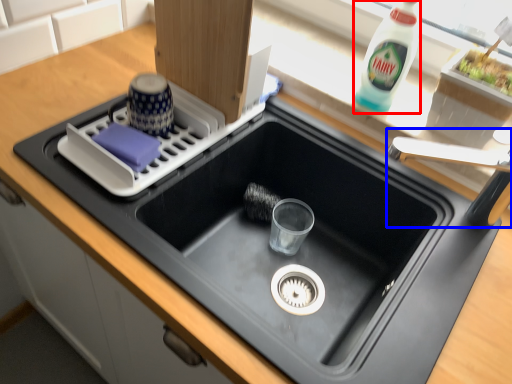
Question: Which of the following is the farthest to the observer, bottle (highlighted by a red box) or faucet (highlighted by a blue box)?

Choices:
 (A) bottle
 (B) faucet

Answer: (A)